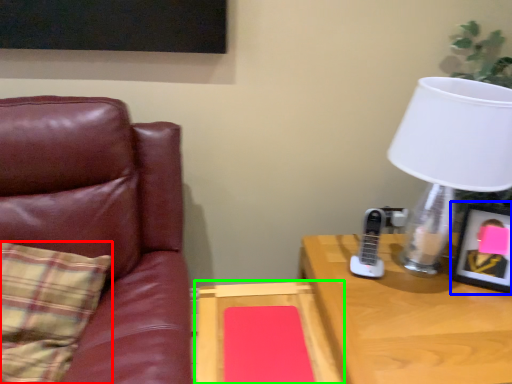
Question: Based on their relative distances, which object is nearer to pillow (highlighted by a red box)? Choose from picture frame (highlighted by a blue box) and table (highlighted by a green box).

Choices:
 (A) picture frame
 (B) table

Answer: (B)